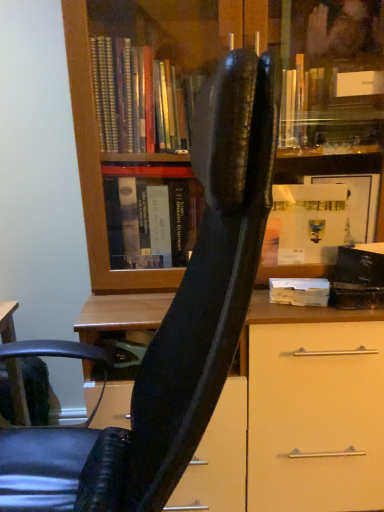
Question: Is point (294, 290) closer or farther from the camera than point (157, 490)?

Choices:
 (A) closer
 (B) farther

Answer: (B)

Question: Is wooden block at center inside or outside of black leather chair at center?

Choices:
 (A) outside
 (B) inside

Answer: (A)

Question: From the image's perspective, is wooden block at center located above or below black leather chair at center?

Choices:
 (A) above
 (B) below

Answer: (A)

Question: In terms of height, does black leather chair at center look taller or shorter compared to wooden block at center?

Choices:
 (A) tall
 (B) short

Answer: (A)

Question: From the image's perspective, is black leather chair at center located above or below wooden block at center?

Choices:
 (A) below
 (B) above

Answer: (A)

Question: Does point (140, 369) appear closer or farther from the camera than point (276, 282)?

Choices:
 (A) closer
 (B) farther

Answer: (A)

Question: Is black leather chair at center to the left or to the right of wooden block at center in the image?

Choices:
 (A) left
 (B) right

Answer: (A)